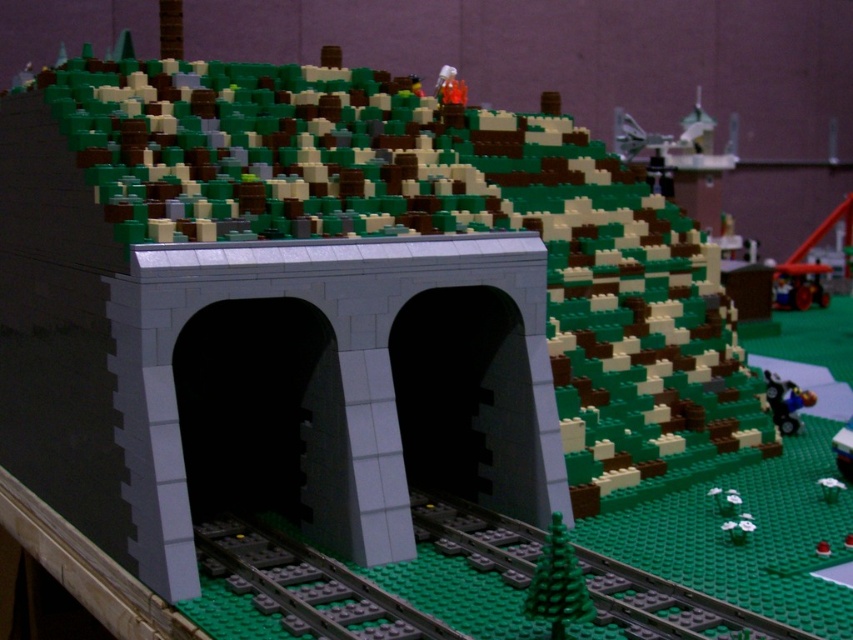
You are a LEGO train engineer planning to build a track between the two points marked as point [602,588] and point [386,628] in the LEGO railway scene. Which point should you start building the track closer to the tunnel first?

You should start building the track closer to point [602,588] first because it is closer to the tunnel than point [386,628].

You are a train engineer planning a route through the LEGO railway scene. You notice the green plastic train track at lower center and the gray metallic train track at lower center. Which track should you choose to take the shortest path towards the tunnel?

You should choose the green plastic train track at lower center because it is closer to the viewer than the gray metallic train track at lower center, making it the shorter path towards the tunnel.

You are a LEGO designer trying to place a new train car in the scene. The train car needs to be placed exactly at point (666, 605). Which object in the scene is located at that point?

The green plastic train track at lower center is located at point (666, 605).